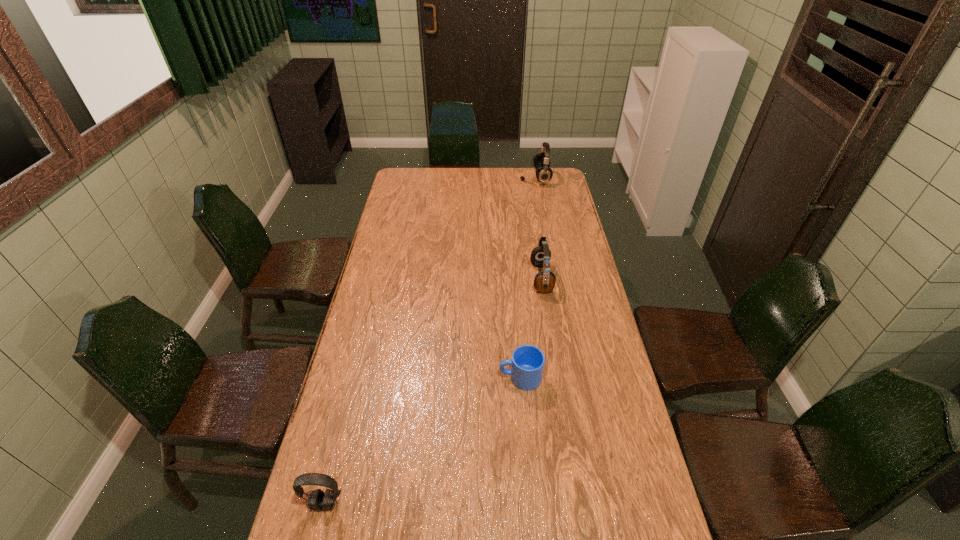
At what (x,y) coordinates should I click in order to perform the action: click on free location located on the ear cups of the second farthest headset. Please return your answer as a coordinate pair (x, y). The height and width of the screenshot is (540, 960). Looking at the image, I should click on (495, 279).

At what (x,y) coordinates should I click in order to perform the action: click on free spot located on the ear cups of the second farthest headset. Please return your answer as a coordinate pair (x, y). The width and height of the screenshot is (960, 540). Looking at the image, I should click on (472, 279).

This screenshot has width=960, height=540. I want to click on vacant position located on the side of the third object from right to left with the handle, so click(x=438, y=377).

This screenshot has height=540, width=960. I want to click on blank area located on the side of the third object from right to left with the handle, so click(x=451, y=377).

At what (x,y) coordinates should I click in order to perform the action: click on vacant space located on the side of the third object from right to left with the handle. Please return your answer as a coordinate pair (x, y). The height and width of the screenshot is (540, 960). Looking at the image, I should click on (381, 377).

At what (x,y) coordinates should I click in order to perform the action: click on object located at the far edge. Please return your answer as a coordinate pair (x, y). Looking at the image, I should click on (544, 173).

I want to click on object that is positioned at the left edge, so click(318, 500).

At what (x,y) coordinates should I click in order to perform the action: click on object present at the far right corner. Please return your answer as a coordinate pair (x, y). This screenshot has width=960, height=540. Looking at the image, I should click on (544, 173).

At what (x,y) coordinates should I click in order to perform the action: click on free region at the far edge of the desktop. Please return your answer as a coordinate pair (x, y). Looking at the image, I should click on (431, 181).

Where is `free space at the left edge`? This screenshot has height=540, width=960. free space at the left edge is located at coordinates (410, 208).